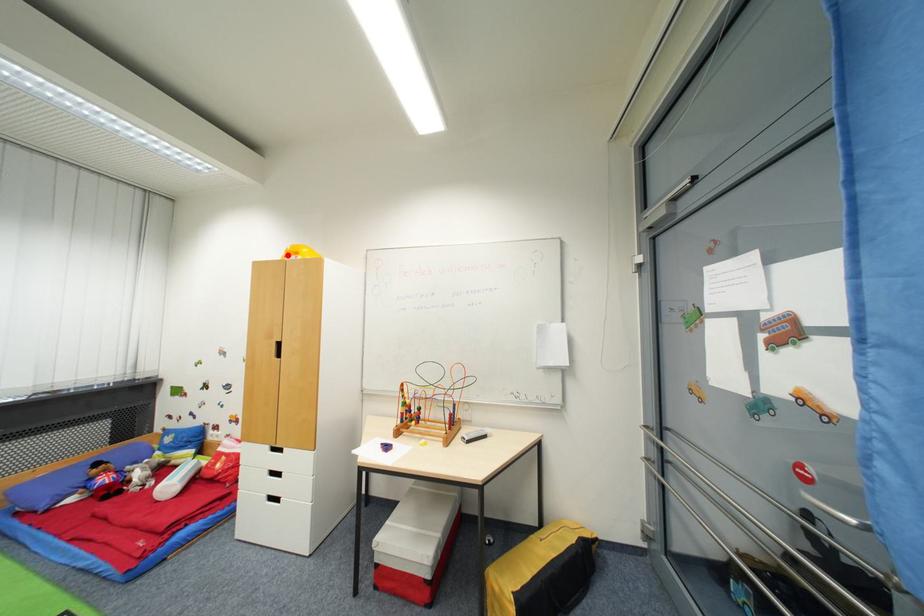
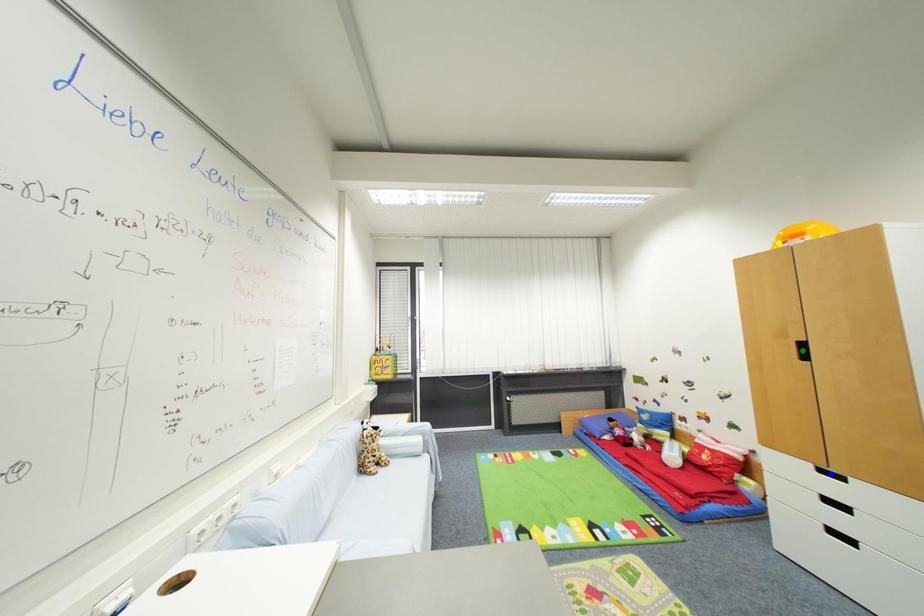
Question: I am providing you with two images of the same scene from different viewpoints. A red point is marked on the first image. You are given multiple points on the second image. Which point in image 2 is actually the same real-world point as the red point in image 1?

Choices:
 (A) yellow point
 (B) blue point
 (C) green point

Answer: (A)